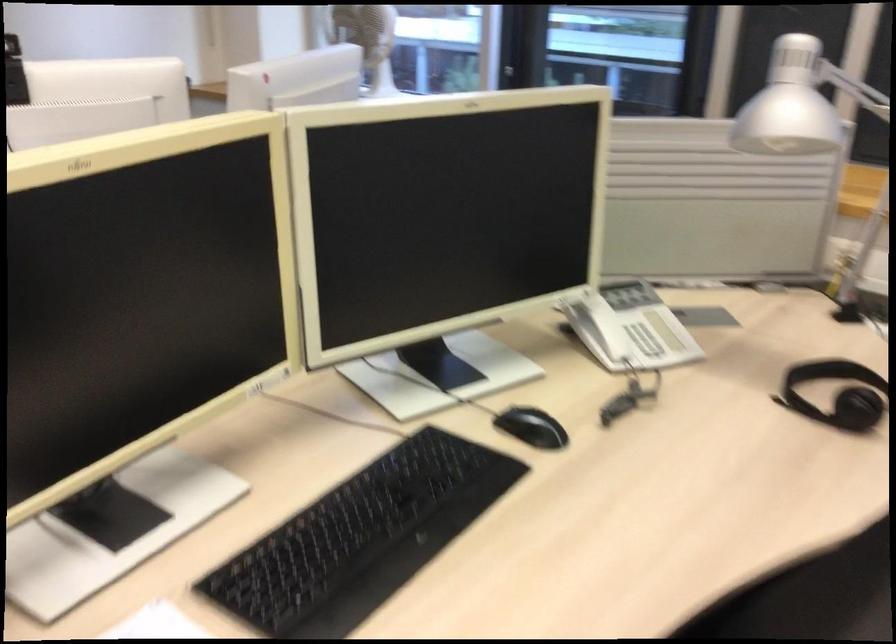
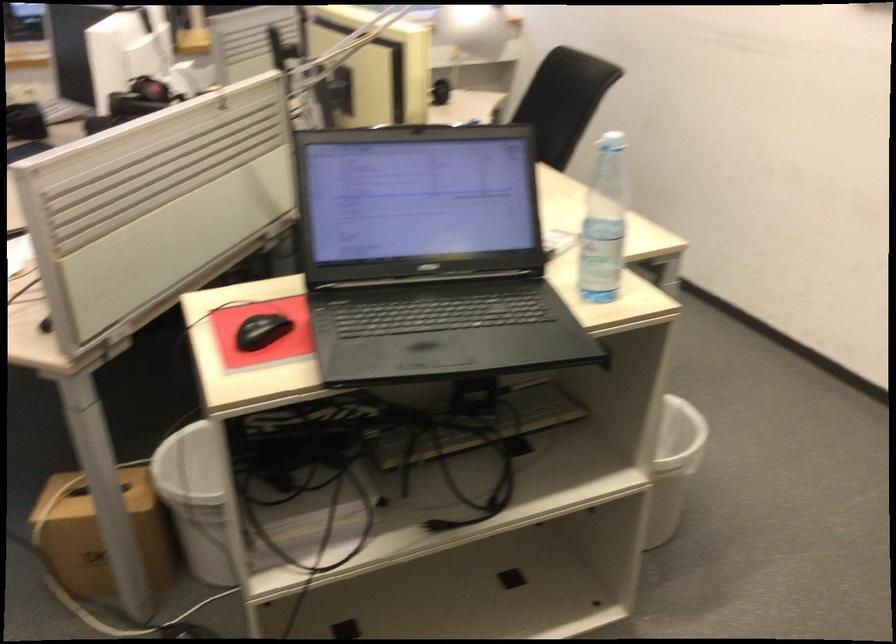
Question: I am providing you with two images of the same scene from different viewpoints. Which of the following objects are not visible in image2?

Choices:
 (A) white bottle cap
 (B) control panel knob
 (C) brown cardboard box
 (D) black computer mouse

Answer: (D)